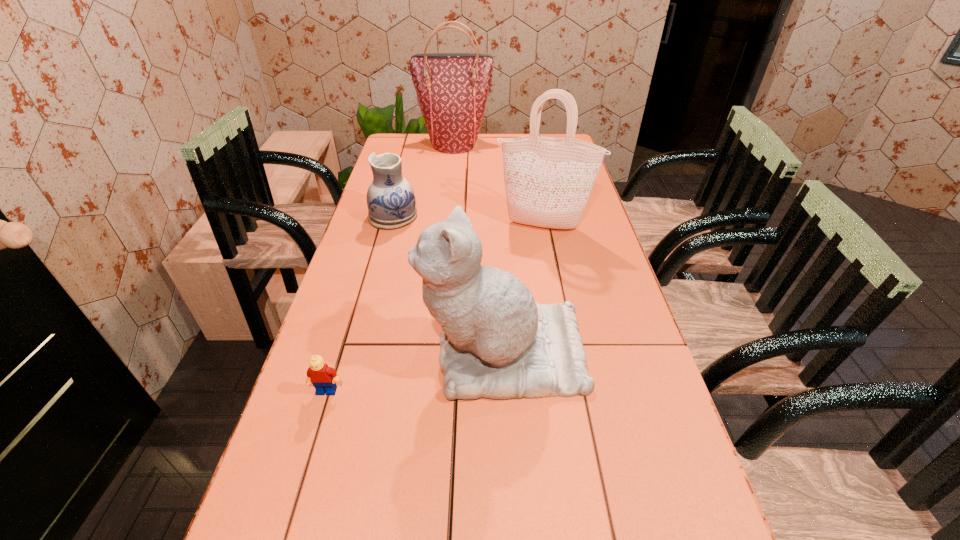
Find the location of a particular element. handbag is located at coordinates (452, 88).

This screenshot has height=540, width=960. I want to click on shopping bag, so click(548, 181).

At what (x,y) coordinates should I click in order to perform the action: click on cat. Please return your answer as a coordinate pair (x, y). This screenshot has height=540, width=960. Looking at the image, I should click on (496, 342).

This screenshot has height=540, width=960. I want to click on pottery, so click(x=391, y=202).

Identify the location of the shortest object. [x=323, y=378].

The height and width of the screenshot is (540, 960). Identify the location of free spot located 0.130m on the right of the handbag. (522, 144).

I want to click on free space located on the back of the shopping bag, so pos(535,179).

Identify the location of vacant area located 0.100m on the front-facing side of the cat. (378, 353).

Image resolution: width=960 pixels, height=540 pixels. Find the location of `free space located 0.200m on the front-facing side of the cat`. free space located 0.200m on the front-facing side of the cat is located at coordinates (336, 353).

Where is `free spot located 0.240m on the front-facing side of the cat`? The height and width of the screenshot is (540, 960). free spot located 0.240m on the front-facing side of the cat is located at coordinates (319, 353).